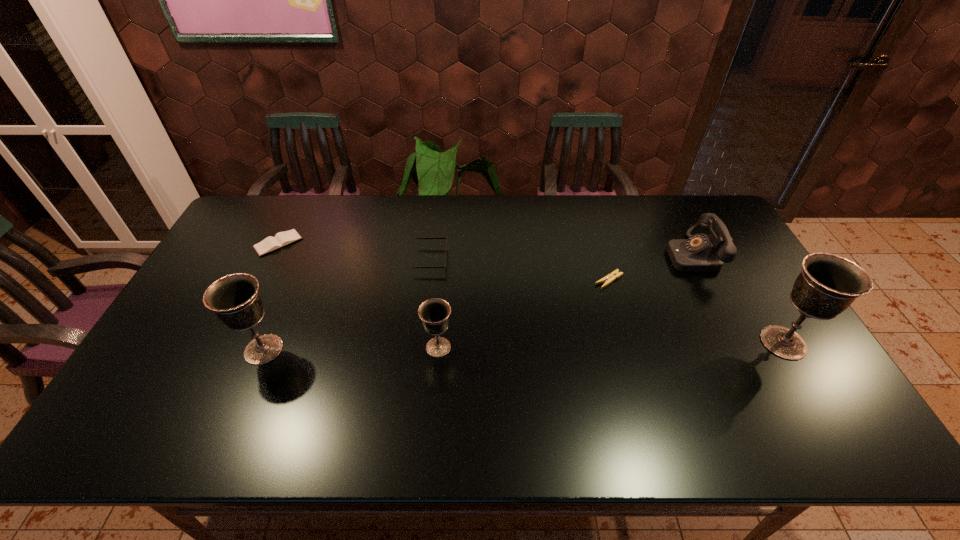
The width and height of the screenshot is (960, 540). What are the coordinates of `object situated at the left edge` in the screenshot? It's located at (281, 239).

Locate an element on the screen. The height and width of the screenshot is (540, 960). chalice that is at the right edge is located at coordinates (828, 284).

Locate an element on the screen. The width and height of the screenshot is (960, 540). telephone that is at the right edge is located at coordinates (699, 253).

This screenshot has width=960, height=540. Find the location of `object positioned at the far left corner`. object positioned at the far left corner is located at coordinates (281, 239).

Identify the location of object that is at the far right corner. (699, 253).

In the image, there is a desktop. Identify the location of vacant space at the far edge. This screenshot has height=540, width=960. (668, 220).

This screenshot has height=540, width=960. I want to click on free space at the near edge of the desktop, so 424,389.

I want to click on free space at the left edge of the desktop, so click(x=252, y=251).

Locate an element on the screen. vacant area at the far left corner is located at coordinates (262, 235).

At what (x,y) coordinates should I click in order to perform the action: click on vacant space at the near right corner of the desktop. Please return your answer as a coordinate pair (x, y). Image resolution: width=960 pixels, height=540 pixels. Looking at the image, I should click on (789, 402).